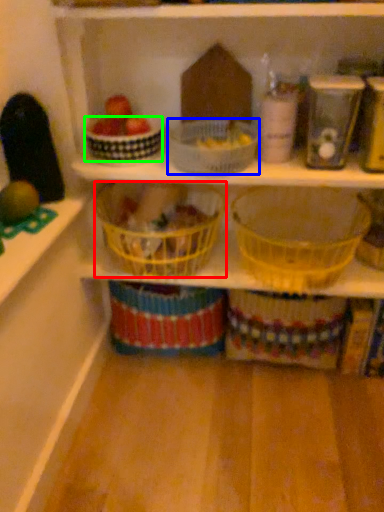
Question: Considering the real-world distances, which object is farthest from basket (highlighted by a red box)? basket (highlighted by a blue box) or basket (highlighted by a green box)?

Choices:
 (A) basket
 (B) basket

Answer: (B)